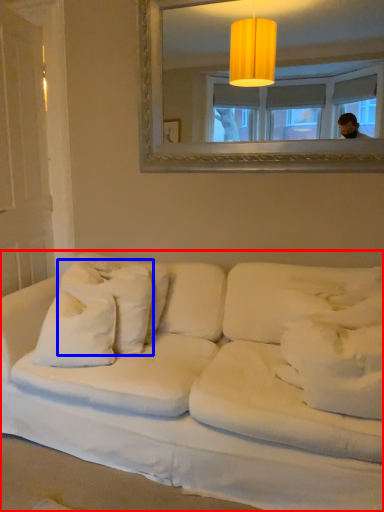
Question: Which point is further to the camera, studio couch (highlighted by a red box) or pillow (highlighted by a blue box)?

Choices:
 (A) studio couch
 (B) pillow

Answer: (B)